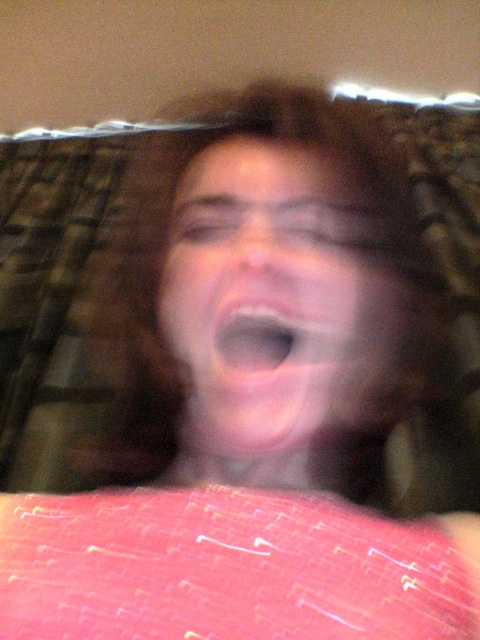
Question: Which point is farther to the camera?

Choices:
 (A) pink matte face at center
 (B) pink flesh-colored mouth at center

Answer: (B)

Question: Is pink matte face at center wider than pink flesh-colored mouth at center?

Choices:
 (A) no
 (B) yes

Answer: (B)

Question: Does pink matte face at center appear over pink flesh-colored mouth at center?

Choices:
 (A) yes
 (B) no

Answer: (A)

Question: Does pink matte face at center have a greater width compared to pink flesh-colored mouth at center?

Choices:
 (A) no
 (B) yes

Answer: (B)

Question: Which point is farther to the camera?

Choices:
 (A) pink matte face at center
 (B) pink flesh-colored mouth at center

Answer: (B)